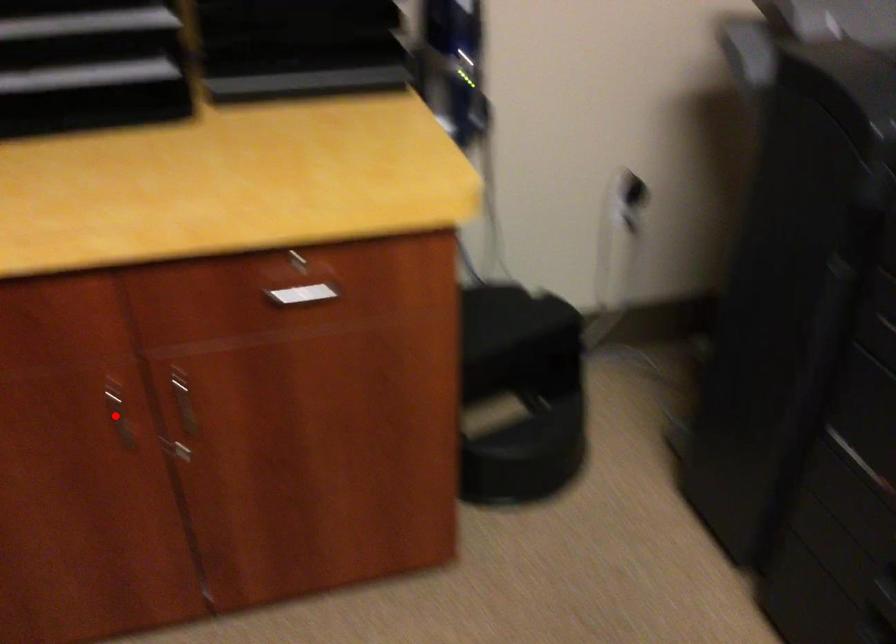
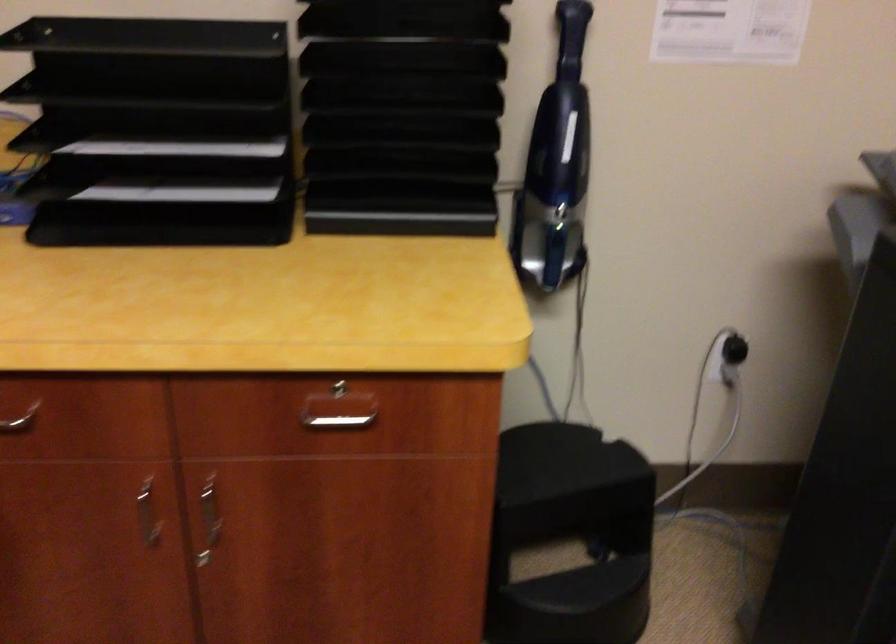
Where in the second image is the point corresponding to the highlighted location from the first image?

(148, 514)